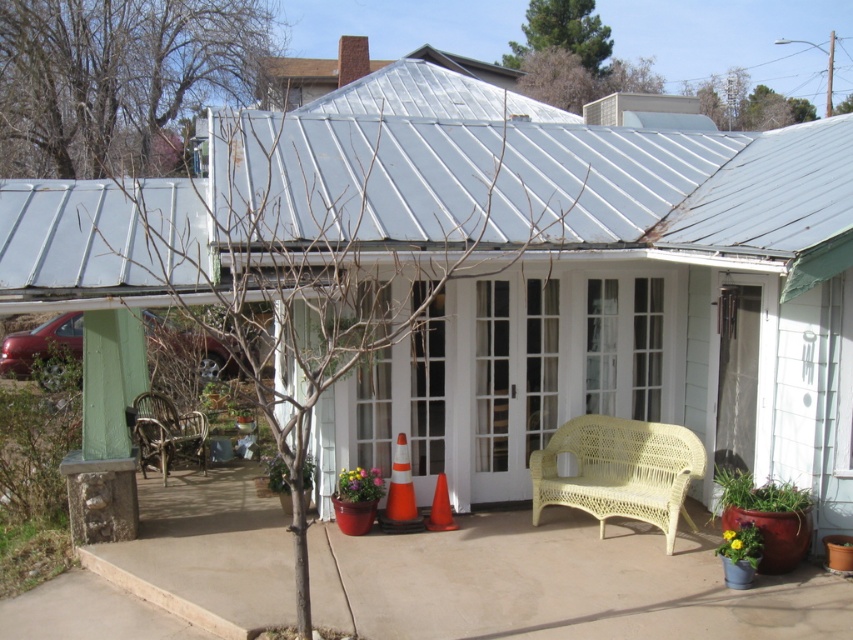
Consider the image. Can you confirm if smooth concrete patio at lower center is wider than orange/reflective traffic cone at center?

Indeed, smooth concrete patio at lower center has a greater width compared to orange/reflective traffic cone at center.

Does smooth concrete patio at lower center have a smaller size compared to orange/reflective traffic cone at center?

No, smooth concrete patio at lower center is not smaller than orange/reflective traffic cone at center.

Who is more forward, (204, 573) or (399, 506)?

Positioned in front is point (204, 573).

Find the location of a particular element. smooth concrete patio at lower center is located at coordinates [x=556, y=582].

Which is above, smooth concrete patio at lower center or green matte flower pot at center?

green matte flower pot at center is higher up.

Can you confirm if smooth concrete patio at lower center is taller than green matte flower pot at center?

No.

Between point (627, 573) and point (369, 490), which one is positioned in front?

Point (627, 573) is more forward.

You are a GUI agent. You are given a task and a screenshot of the screen. Output one action in this format:
    pyautogui.click(x=<x>, y=<y>)
    Task: Click on the smooth concrete patio at lower center
    Image resolution: width=853 pixels, height=640 pixels.
    Given the screenshot: What is the action you would take?
    pyautogui.click(x=556, y=582)

This screenshot has width=853, height=640. Find the location of `green matte flower pot at center`. green matte flower pot at center is located at coordinates (358, 484).

Is point (379, 484) closer to viewer compared to point (267, 477)?

That is True.

The height and width of the screenshot is (640, 853). I want to click on green matte flower pot at center, so click(358, 484).